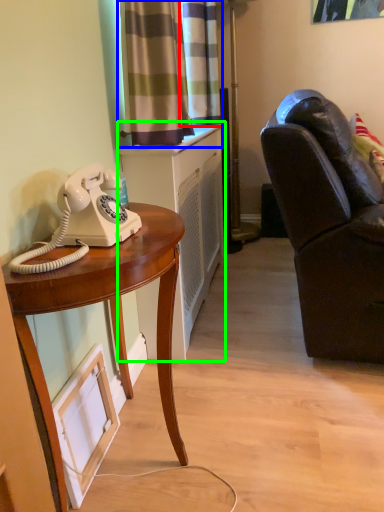
Question: Which object is the farthest from curtain (highlighted by a red box)? Choose among these: curtain (highlighted by a blue box) or cabinetry (highlighted by a green box).

Choices:
 (A) curtain
 (B) cabinetry

Answer: (B)